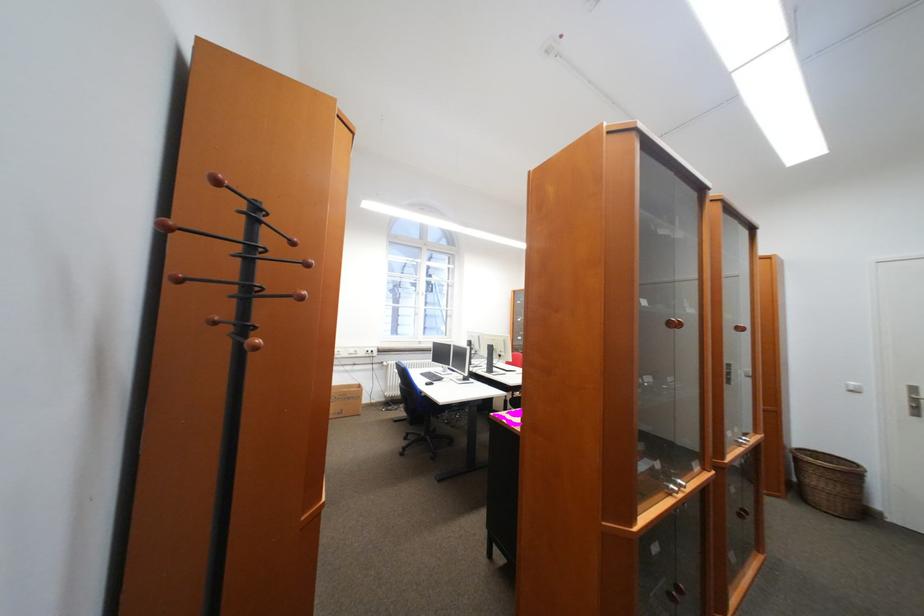
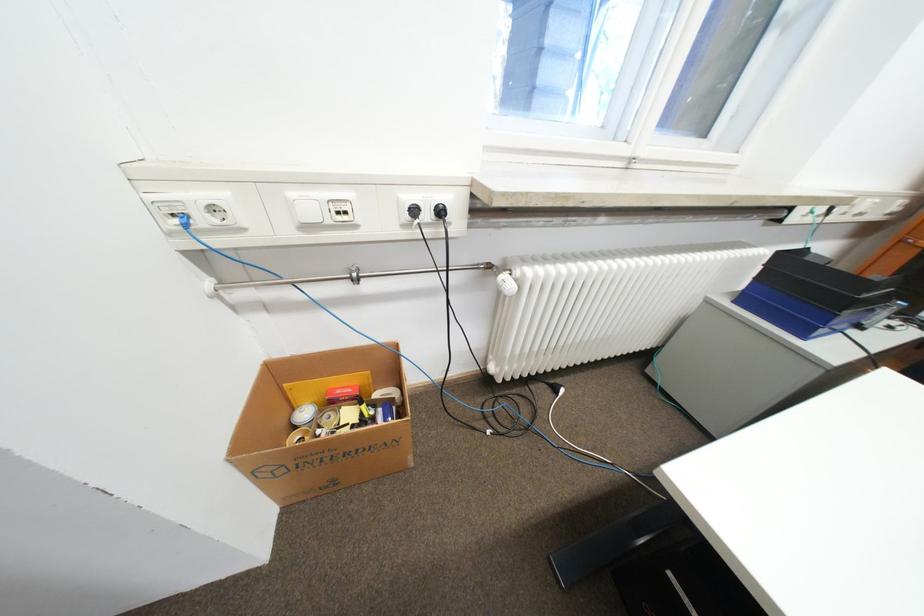
The point at [379,353] is marked in the first image. Where is the corresponding point in the second image?

(436, 216)